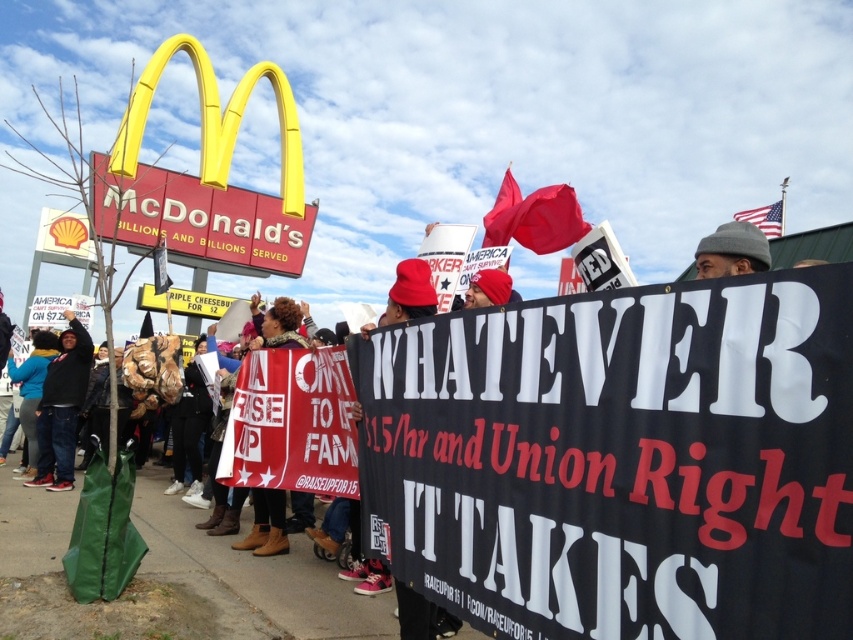
You are a photographer trying to capture both the black fabric banner at center and the red plastic sign at upper left in a single frame. Which object should you focus on first to ensure both are in the frame?

The black fabric banner at center is not as tall as the red plastic sign at upper left, so you should focus on the red plastic sign at upper left first to ensure both are in the frame.

From the picture: You are a photographer standing 5.73 feet away from the black fabric banner at center. You want to take a photo of the banner without including the McDonalds sign in the background. Is the distance sufficient to frame the banner alone?

The black fabric banner at center and camera are 5.73 feet apart. Since the distance matches your position, you can frame the banner alone without the McDonalds sign in the background.

You are a photographer positioned at the center of the scene. You want to capture a photo of the black fabric banner at center without including the McDonald sign on the left. Is the banner positioned far enough to the right to avoid the sign in the frame?

The black fabric banner at center is located at point (x=621, y=460), which means it is positioned far enough to the right to avoid including the McDonald sign on the left in the frame.